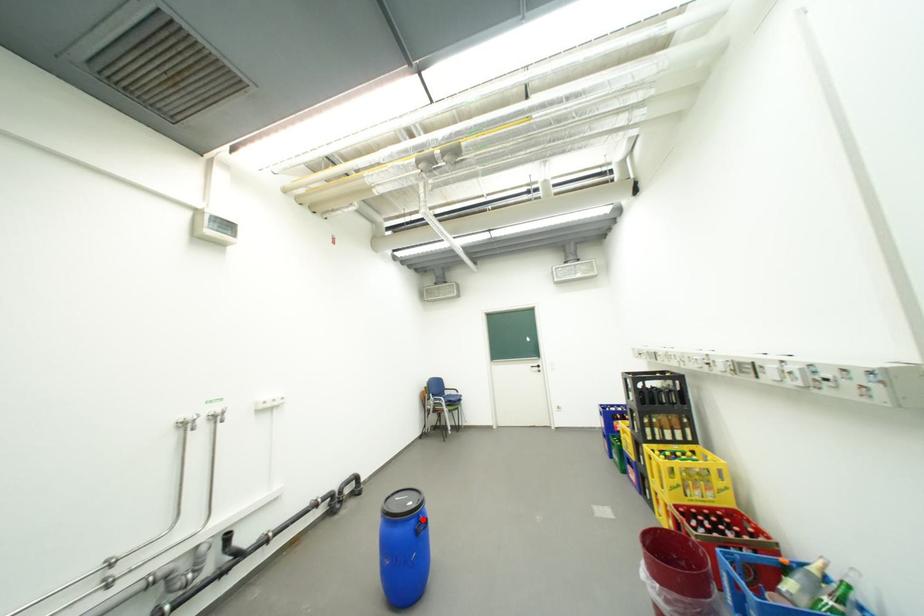
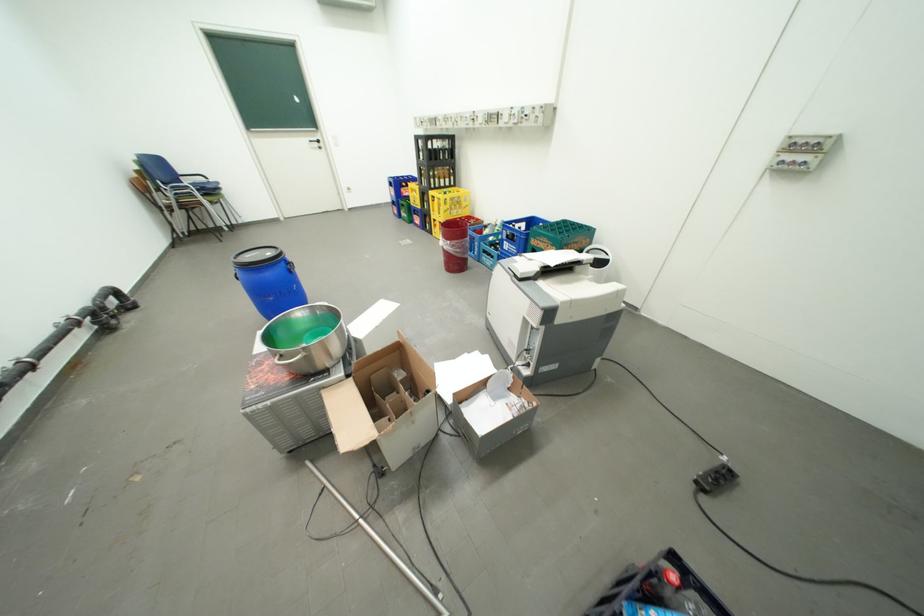
Question: I am providing you with two images of the same scene from different viewpoints. A red point is shown in image1. For the corresponding object point in image2, is it positioned nearer or farther from the camera?

Choices:
 (A) Nearer
 (B) Farther

Answer: (A)